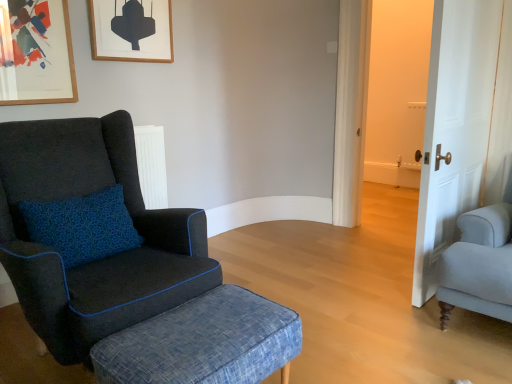
Question: From a real-world perspective, is wooden picture frame at upper center, positioned as the 2th picture frame in left-to-right order, positioned above or below denim textured stool at lower left?

Choices:
 (A) below
 (B) above

Answer: (B)

Question: Is point (102, 57) positioned closer to the camera than point (294, 349)?

Choices:
 (A) farther
 (B) closer

Answer: (A)

Question: Based on their relative distances, which object is nearer to the denim textured stool at lower left?

Choices:
 (A) velvet dark blue armchair at left
 (B) wooden picture frame at upper center, which is counted as the first picture frame, starting from the right
 (C) wooden picture frame at upper left, the 2th picture frame positioned from the back
 (D) white wood door at right

Answer: (A)

Question: Estimate the real-world distances between objects in this image. Which object is closer to the wooden picture frame at upper left, the first picture frame positioned from the front?

Choices:
 (A) denim textured stool at lower left
 (B) velvet dark blue armchair at left
 (C) white wood door at right
 (D) wooden picture frame at upper center, which is counted as the first picture frame, starting from the right

Answer: (D)